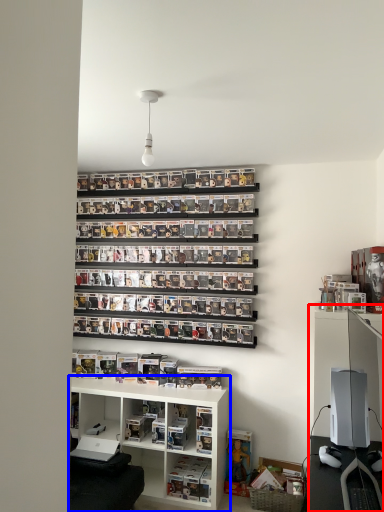
Question: Which object appears farthest to the camera in this image, entertainment center (highlighted by a red box) or shelf (highlighted by a blue box)?

Choices:
 (A) entertainment center
 (B) shelf

Answer: (B)